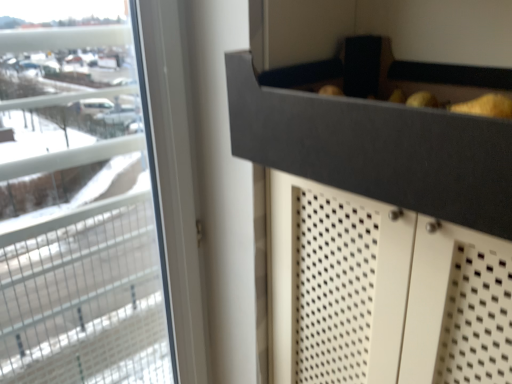
Question: From the image's perspective, is black matte drawer at upper center above or below transparent glass window at left?

Choices:
 (A) above
 (B) below

Answer: (A)

Question: Is black matte drawer at upper center bigger or smaller than transparent glass window at left?

Choices:
 (A) big
 (B) small

Answer: (B)

Question: Considering the positions of point pos(284,77) and point pos(141,82), is point pos(284,77) closer or farther from the camera than point pos(141,82)?

Choices:
 (A) farther
 (B) closer

Answer: (B)

Question: Considering their positions, is transparent glass window at left located in front of or behind black matte drawer at upper center?

Choices:
 (A) behind
 (B) front

Answer: (A)

Question: From the image's perspective, is transparent glass window at left positioned above or below black matte drawer at upper center?

Choices:
 (A) below
 (B) above

Answer: (A)

Question: Is point (42, 233) positioned closer to the camera than point (414, 84)?

Choices:
 (A) farther
 (B) closer

Answer: (A)

Question: In terms of size, does transparent glass window at left appear bigger or smaller than black matte drawer at upper center?

Choices:
 (A) small
 (B) big

Answer: (B)